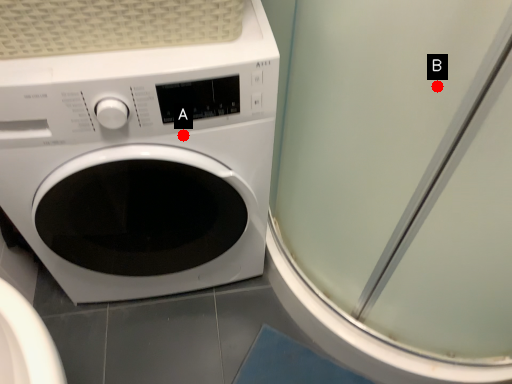
Question: Two points are circled on the image, labeled by A and B beside each circle. Which point is further to the camera?

Choices:
 (A) A is further
 (B) B is further

Answer: (A)